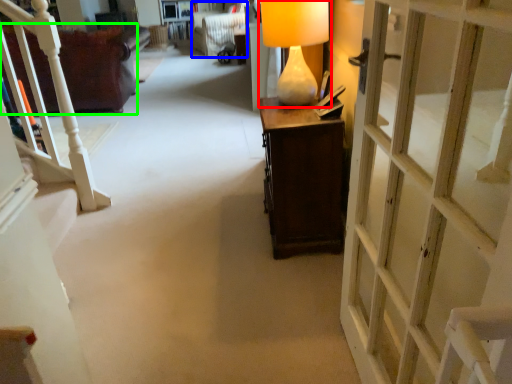
Question: Which object is the closest to the table lamp (highlighted by a red box)? Choose among these: armchair (highlighted by a blue box) or furniture (highlighted by a green box).

Choices:
 (A) armchair
 (B) furniture

Answer: (B)